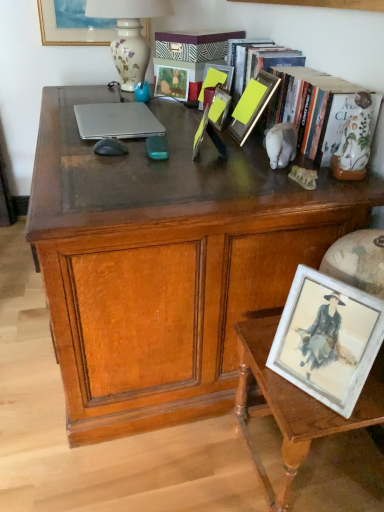
You are a GUI agent. You are given a task and a screenshot of the screen. Output one action in this format:
    pyautogui.click(x=<x>, y=<y>)
    Task: Click on the free point behind transparent plastic mobile phone at center
    The image size is (384, 512).
    Given the screenshot: What is the action you would take?
    pyautogui.click(x=169, y=139)